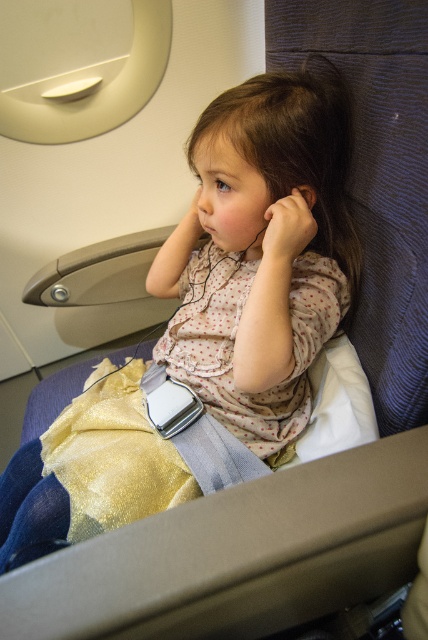
From the picture: Can you confirm if gold glitter skirt at center is shorter than matte skin hand at center?

No, gold glitter skirt at center is not shorter than matte skin hand at center.

What do you see at coordinates (261, 252) in the screenshot?
I see `gold glitter skirt at center` at bounding box center [261, 252].

The image size is (428, 640). What are the coordinates of `gold glitter skirt at center` in the screenshot? It's located at (261, 252).